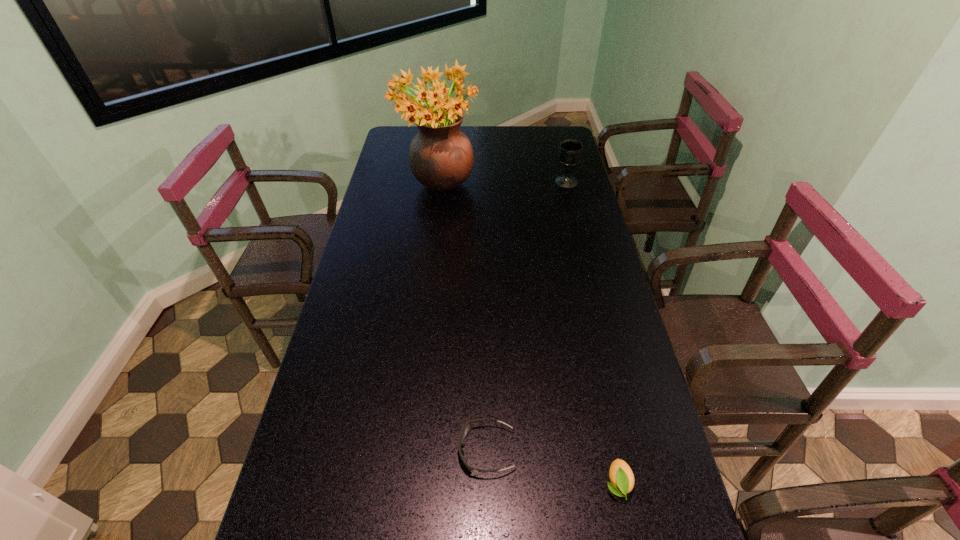
Where is `the tallest object`? the tallest object is located at coordinates (441, 158).

The image size is (960, 540). What are the coordinates of `chalice` in the screenshot? It's located at (570, 151).

The height and width of the screenshot is (540, 960). I want to click on the third tallest object, so click(621, 476).

The image size is (960, 540). I want to click on the shortest object, so click(x=465, y=429).

Locate an element on the screen. free space located 0.050m on the left of the flower arrangement is located at coordinates (387, 190).

Locate an element on the screen. Image resolution: width=960 pixels, height=540 pixels. vacant space located on the left of the chalice is located at coordinates (457, 182).

Locate an element on the screen. The width and height of the screenshot is (960, 540). vacant space located on the lenses of the goggles is located at coordinates (414, 450).

What are the coordinates of `free space located on the lenses of the goggles` in the screenshot? It's located at pyautogui.click(x=392, y=450).

Identify the location of free space located on the lenses of the goggles. Image resolution: width=960 pixels, height=540 pixels. (373, 450).

At what (x,y) coordinates should I click in order to perform the action: click on object that is at the left edge. Please return your answer as a coordinate pair (x, y). Looking at the image, I should click on (441, 158).